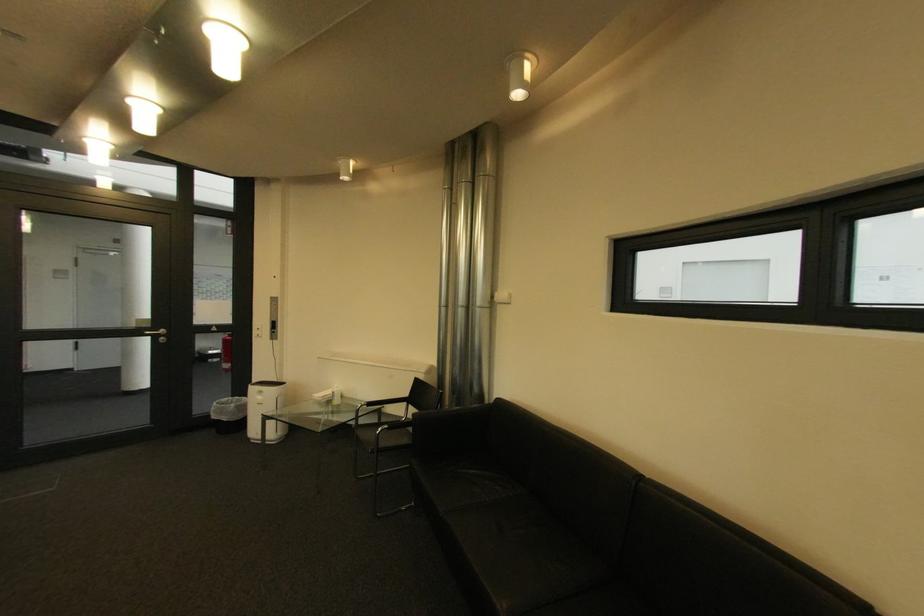
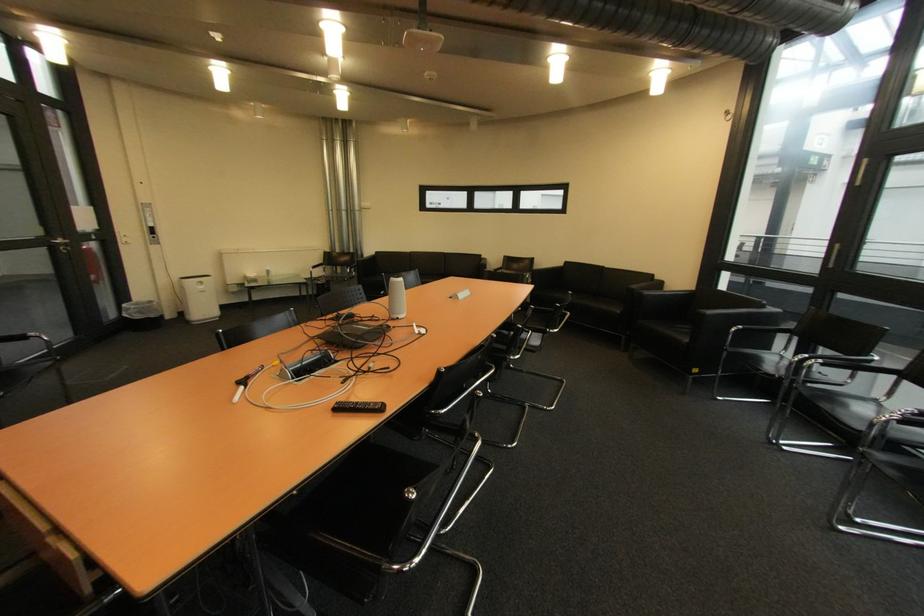
In the second image, find the point that corresponds to the point at 223,418 in the first image.

(147, 318)